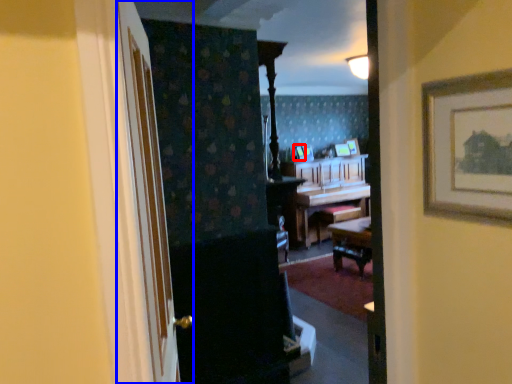
Question: Which point is closer to the camera, picture frame (highlighted by a red box) or door (highlighted by a blue box)?

Choices:
 (A) picture frame
 (B) door

Answer: (B)